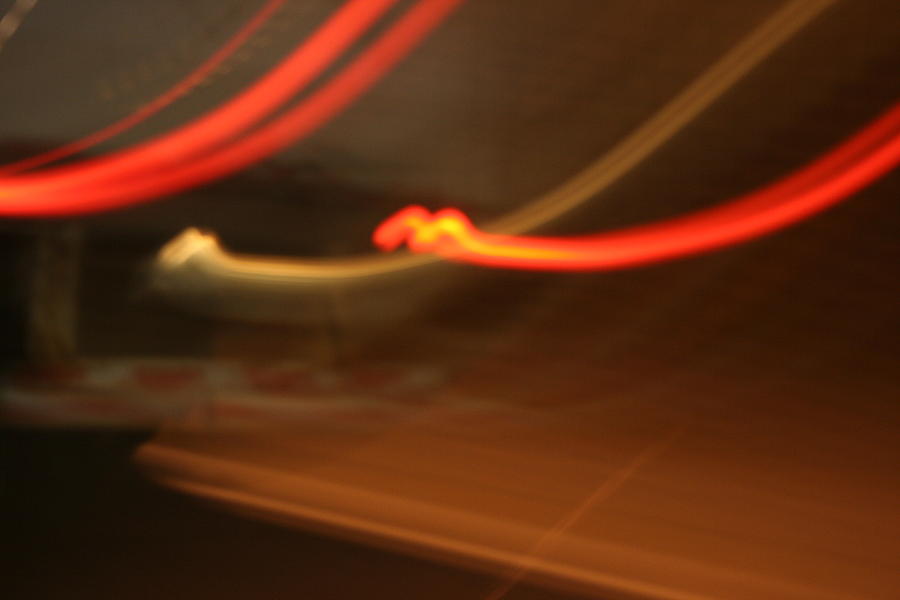
Image resolution: width=900 pixels, height=600 pixels. In order to click on floor in this screenshot , I will do `click(518, 485)`.